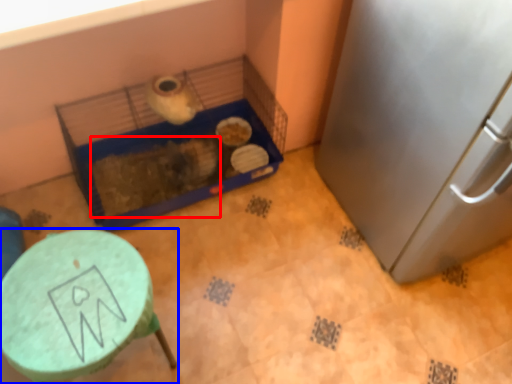
Question: Which object is closer to the camera taking this photo, animal (highlighted by a red box) or furniture (highlighted by a blue box)?

Choices:
 (A) animal
 (B) furniture

Answer: (B)